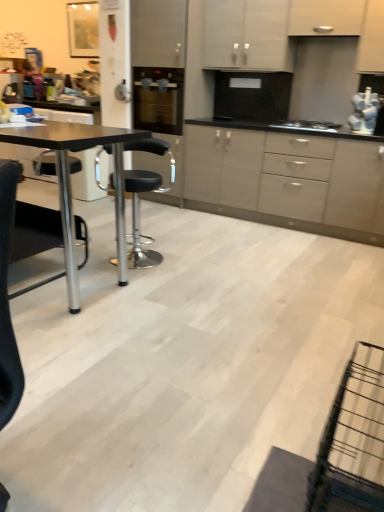
Question: Considering the positions of white matte cabinet at upper center, which is counted as the third cabinetry, starting from the bottom, and black leather stool at center in the image, is white matte cabinet at upper center, which is counted as the third cabinetry, starting from the bottom, taller or shorter than black leather stool at center?

Choices:
 (A) short
 (B) tall

Answer: (A)

Question: Does point (205, 15) appear closer or farther from the camera than point (158, 176)?

Choices:
 (A) closer
 (B) farther

Answer: (B)

Question: Estimate the real-world distances between objects in this image. Which object is closer to the black matte table at left?

Choices:
 (A) black glass oven at center
 (B) white matte cabinet at upper center, which is counted as the second cabinetry, starting from the bottom
 (C) matte gray cabinets at center, acting as the 3th cabinetry starting from the top
 (D) black glass gas stove at center
 (E) white matte cabinet at upper center, which is counted as the first cabinetry, starting from the top

Answer: (A)

Question: Which object is positioned farthest from the white matte cabinet at upper center, which is counted as the third cabinetry, starting from the bottom?

Choices:
 (A) white matte cabinet at upper center, which is the 2th cabinetry in top-to-bottom order
 (B) black glass gas stove at center
 (C) black leather stool at center
 (D) black glass oven at center
 (E) matte gray cabinets at center, which is the 1th cabinetry from bottom to top

Answer: (C)